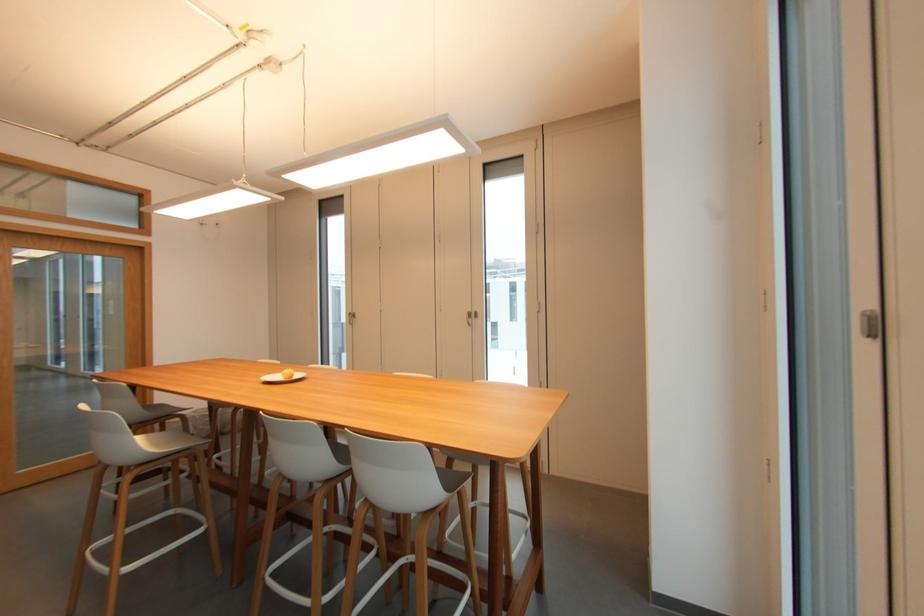
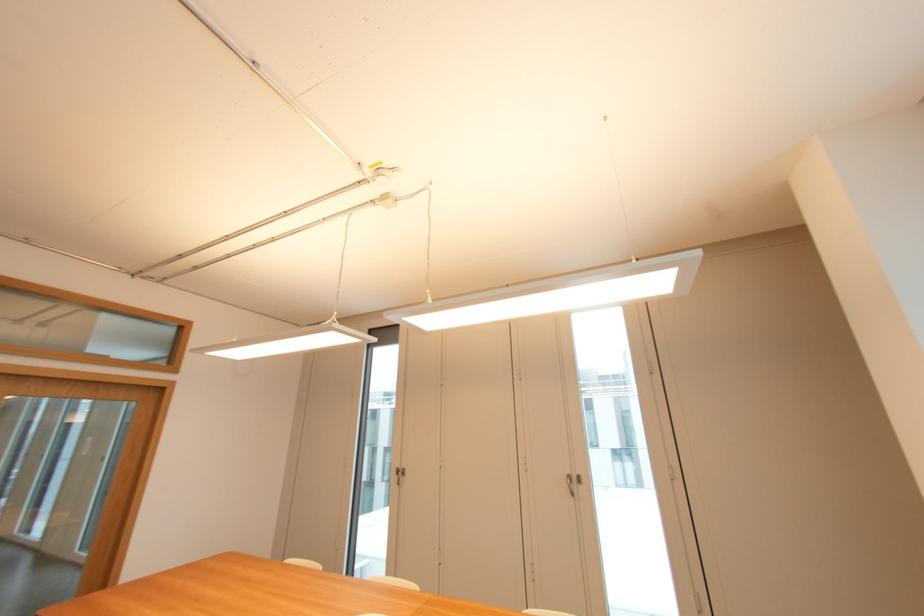
The point at (x=473, y=310) is marked in the first image. Where is the corresponding point in the second image?

(574, 472)